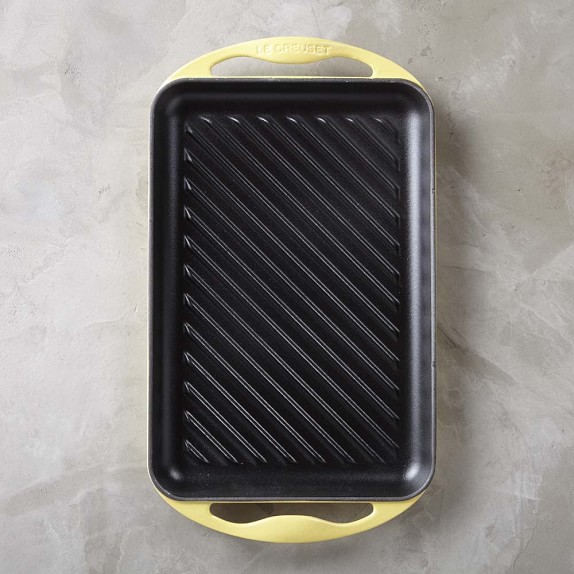
Where is `casserole dish`? The width and height of the screenshot is (574, 574). casserole dish is located at coordinates (269, 358).